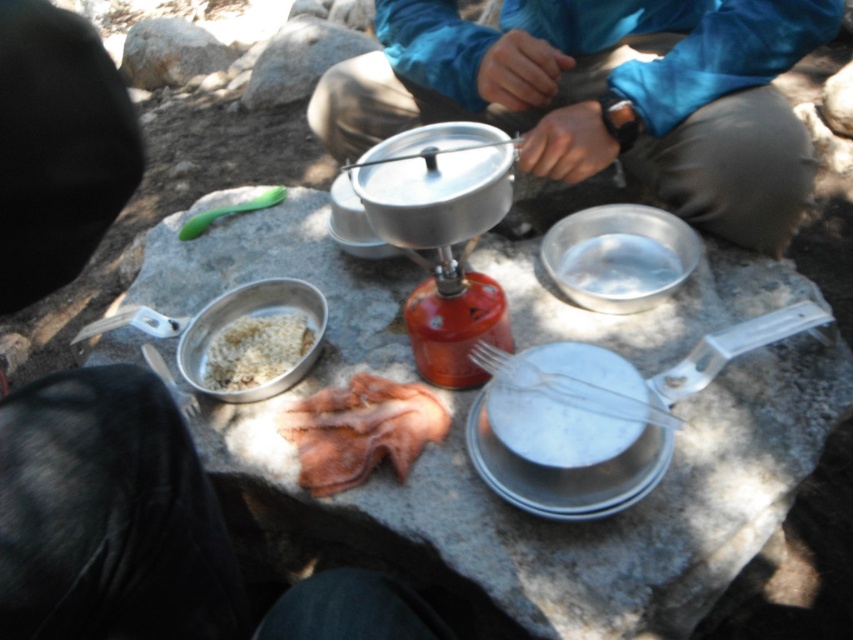
Is brushed metal cooking set at center smaller than blue fabric jacket at upper center?

No.

Which of these two, brushed metal cooking set at center or blue fabric jacket at upper center, stands shorter?

blue fabric jacket at upper center is shorter.

Who is more distant from viewer, (x=386, y=557) or (x=735, y=212)?

Point (x=735, y=212)

Where is `brushed metal cooking set at center`? brushed metal cooking set at center is located at coordinates (473, 468).

In the scene shown: Does brushed metal cooking set at center have a greater height compared to pink fabric at center?

Yes, brushed metal cooking set at center is taller than pink fabric at center.

Which is more to the right, brushed metal cooking set at center or pink fabric at center?

From the viewer's perspective, brushed metal cooking set at center appears more on the right side.

At what (x,y) coordinates should I click in order to perform the action: click on brushed metal cooking set at center. Please return your answer as a coordinate pair (x, y). Image resolution: width=853 pixels, height=640 pixels. Looking at the image, I should click on [473, 468].

Who is positioned more to the left, blue fabric jacket at upper center or white matte rice at center left?

From the viewer's perspective, white matte rice at center left appears more on the left side.

In the scene shown: Can you confirm if blue fabric jacket at upper center is positioned above white matte rice at center left?

Correct, blue fabric jacket at upper center is located above white matte rice at center left.

Measure the distance between blue fabric jacket at upper center and camera.

blue fabric jacket at upper center and camera are 3.51 feet apart from each other.

Where is `blue fabric jacket at upper center`? blue fabric jacket at upper center is located at coordinates (604, 96).